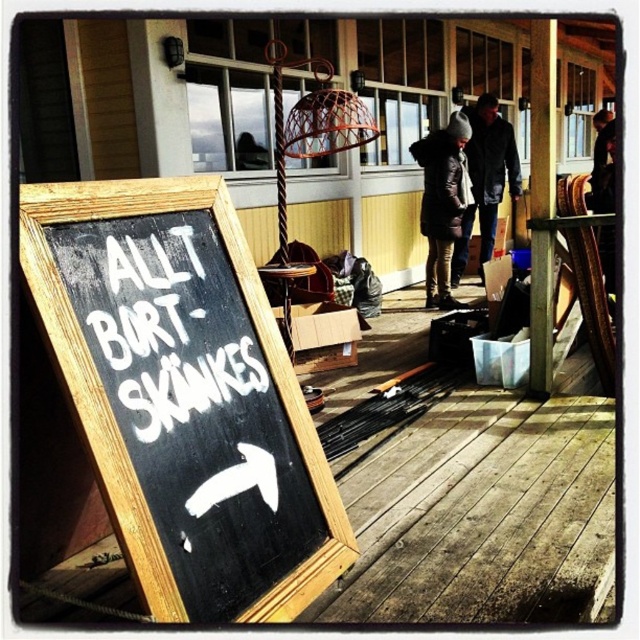
Question: Can you confirm if black chalkboard at left is positioned to the left of dark brown fur coat at center?

Choices:
 (A) yes
 (B) no

Answer: (A)

Question: Estimate the real-world distances between objects in this image. Which object is closer to the dark gray woolen hat at center?

Choices:
 (A) black chalkboard at left
 (B) black wood deck at center
 (C) white chalkboard sign at left

Answer: (B)

Question: Estimate the real-world distances between objects in this image. Which object is closer to the white chalkboard sign at left?

Choices:
 (A) black wood deck at center
 (B) dark brown fur coat at center
 (C) dark gray woolen hat at center

Answer: (A)

Question: Can you confirm if black chalkboard at left is bigger than white chalkboard sign at left?

Choices:
 (A) yes
 (B) no

Answer: (A)

Question: Is black wood deck at center bigger than white chalkboard sign at left?

Choices:
 (A) no
 (B) yes

Answer: (B)

Question: Among these objects, which one is nearest to the camera?

Choices:
 (A) dark brown fur coat at center
 (B) dark gray woolen hat at center

Answer: (A)